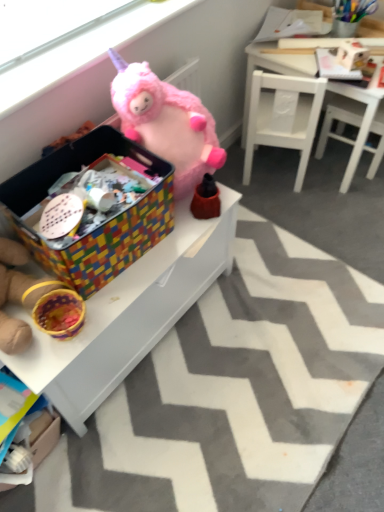
Where is `white matte chair at upper right`? The height and width of the screenshot is (512, 384). white matte chair at upper right is located at coordinates (283, 117).

What do you see at coordinates (128, 314) in the screenshot?
I see `white painted wood table at center, which appears as the first table when ordered from the bottom` at bounding box center [128, 314].

What do you see at coordinates (18, 295) in the screenshot?
I see `multicolored woven basket at left, which is the third toy in top-to-bottom order` at bounding box center [18, 295].

Measure the distance between point [149,246] and camera.

The distance of point [149,246] from camera is 3.88 feet.

Where is `pink plush unicorn at upper center`? The height and width of the screenshot is (512, 384). pink plush unicorn at upper center is located at coordinates (81, 53).

Is brown matte toy at center, which is the second toy in bottom-to-top order, oriented away from white painted wood table at center, which appears as the first table when ordered from the bottom?

brown matte toy at center, which is the second toy in bottom-to-top order, does not have its back to white painted wood table at center, which appears as the first table when ordered from the bottom.

There is a brown matte toy at center, which is the second toy in bottom-to-top order. At what (x,y) coordinates should I click in order to perform the action: click on the 2nd table below it (from a real-world perspective). Please return your answer as a coordinate pair (x, y). Looking at the image, I should click on (128, 314).

Could you measure the distance between brown matte toy at center, the 2th toy when ordered from top to bottom, and white painted wood table at center, the second table from the right?

They are 12.98 inches apart.

Is point (213, 208) positioned before point (134, 268)?

No, it is behind (134, 268).

Between fuzzy pink stuffed animal at upper center, which is counted as the 1th toy, starting from the top, and multicolored woven basket at left, which is the third toy in top-to-bottom order, which one has smaller width?

Thinner between the two is multicolored woven basket at left, which is the third toy in top-to-bottom order.

From a real-world perspective, who is located lower, fuzzy pink stuffed animal at upper center, the 3th toy positioned from the bottom, or multicolored woven basket at left, the 1th toy ordered from the bottom?

In real-world perspective, multicolored woven basket at left, the 1th toy ordered from the bottom, is lower.

Considering the relative sizes of fuzzy pink stuffed animal at upper center, the 3th toy positioned from the bottom, and multicolored woven basket at left, which is the third toy in top-to-bottom order, in the image provided, is fuzzy pink stuffed animal at upper center, the 3th toy positioned from the bottom, shorter than multicolored woven basket at left, which is the third toy in top-to-bottom order,?

In fact, fuzzy pink stuffed animal at upper center, the 3th toy positioned from the bottom, may be taller than multicolored woven basket at left, which is the third toy in top-to-bottom order.

Considering the relative sizes of fuzzy pink stuffed animal at upper center, the 3th toy positioned from the bottom, and multicolored woven basket at left, the 1th toy ordered from the bottom, in the image provided, is fuzzy pink stuffed animal at upper center, the 3th toy positioned from the bottom, bigger than multicolored woven basket at left, the 1th toy ordered from the bottom,?

Yes.

Considering the points (204, 184) and (72, 153), which point is in front, point (204, 184) or point (72, 153)?

The point (72, 153) is closer to the camera.

Is brown matte toy at center, the 2th toy when ordered from top to bottom, facing away from multicolored woven storage box at center?

No, brown matte toy at center, the 2th toy when ordered from top to bottom, is not facing the opposite direction of multicolored woven storage box at center.

Is brown matte toy at center, which is the second toy in bottom-to-top order, far away from multicolored woven storage box at center?

No, brown matte toy at center, which is the second toy in bottom-to-top order, is in close proximity to multicolored woven storage box at center.

Is brown matte toy at center, the 2th toy when ordered from top to bottom, positioned before multicolored woven storage box at center?

No, brown matte toy at center, the 2th toy when ordered from top to bottom, is further to the viewer.

Does fuzzy pink stuffed animal at upper center, the 3th toy positioned from the bottom, turn towards brown matte toy at center, which is the second toy in bottom-to-top order?

Yes.

Is fuzzy pink stuffed animal at upper center, the 3th toy positioned from the bottom, bigger than brown matte toy at center, the 2th toy when ordered from top to bottom?

Indeed, fuzzy pink stuffed animal at upper center, the 3th toy positioned from the bottom, has a larger size compared to brown matte toy at center, the 2th toy when ordered from top to bottom.

Which object is closer to the camera taking this photo, fuzzy pink stuffed animal at upper center, which is counted as the 1th toy, starting from the top, or brown matte toy at center, which is the second toy in bottom-to-top order?

fuzzy pink stuffed animal at upper center, which is counted as the 1th toy, starting from the top, is closer to the camera.

Does fuzzy pink stuffed animal at upper center, which is counted as the 1th toy, starting from the top, have a lesser height compared to brown matte toy at center, the 2th toy when ordered from top to bottom?

In fact, fuzzy pink stuffed animal at upper center, which is counted as the 1th toy, starting from the top, may be taller than brown matte toy at center, the 2th toy when ordered from top to bottom.

Would you say cardboard box at lower left is outside brown matte toy at center, which is the second toy in bottom-to-top order?

cardboard box at lower left is positioned outside brown matte toy at center, which is the second toy in bottom-to-top order.

Considering the sizes of cardboard box at lower left and brown matte toy at center, the 2th toy when ordered from top to bottom, in the image, is cardboard box at lower left taller or shorter than brown matte toy at center, the 2th toy when ordered from top to bottom,?

Considering their sizes, cardboard box at lower left has less height than brown matte toy at center, the 2th toy when ordered from top to bottom.

In the scene shown: Is cardboard box at lower left wider or thinner than brown matte toy at center, which is the second toy in bottom-to-top order?

Clearly, cardboard box at lower left has more width compared to brown matte toy at center, which is the second toy in bottom-to-top order.

Considering the relative sizes of cardboard box at lower left and brown matte toy at center, the 2th toy when ordered from top to bottom, in the image provided, is cardboard box at lower left smaller than brown matte toy at center, the 2th toy when ordered from top to bottom,?

No.

Would you say pink plush unicorn at upper center is part of multicolored woven storage box at center's contents?

No, multicolored woven storage box at center does not contain pink plush unicorn at upper center.

Does multicolored woven storage box at center have a smaller size compared to pink plush unicorn at upper center?

Incorrect, multicolored woven storage box at center is not smaller in size than pink plush unicorn at upper center.

Is multicolored woven storage box at center wider than pink plush unicorn at upper center?

Indeed, multicolored woven storage box at center has a greater width compared to pink plush unicorn at upper center.

From a real-world perspective, is multicolored woven storage box at center positioned under pink plush unicorn at upper center based on gravity?

Yes.

Does pink plush unicorn at upper center have a lesser width compared to multicolored woven storage box at center?

Indeed, pink plush unicorn at upper center has a lesser width compared to multicolored woven storage box at center.

From the image's perspective, relative to multicolored woven storage box at center, is pink plush unicorn at upper center above or below?

From the image's perspective, pink plush unicorn at upper center appears above multicolored woven storage box at center.

Is pink plush unicorn at upper center closer to camera compared to multicolored woven storage box at center?

That is False.

There is a white painted wood table at center, the second table from the right. Identify the location of the 2nd toy above it (from the image's perspective). (206, 199).

What are the coordinates of `toy that is the 1st one when counting backward from the multicolored woven basket at left, the 1th toy ordered from the bottom` in the screenshot? It's located at (166, 122).

Based on their spatial positions, is brown matte toy at center, which is the second toy in bottom-to-top order, or fuzzy pink stuffed animal at upper center, the 3th toy positioned from the bottom, further from cardboard box at lower left?

fuzzy pink stuffed animal at upper center, the 3th toy positioned from the bottom.

Considering their positions, is white matte chair at upper right positioned closer to pink plush unicorn at upper center than white wooden table at upper right, the first table in the top-to-bottom sequence?

white matte chair at upper right is positioned closer to the anchor pink plush unicorn at upper center.

Consider the image. When comparing their distances from multicolored woven basket at left, the 1th toy ordered from the bottom, does white wooden table at upper right, marked as the 1th table in a right-to-left arrangement, or multicolored woven storage box at center seem closer?

Among the two, multicolored woven storage box at center is located nearer to multicolored woven basket at left, the 1th toy ordered from the bottom.

Which object lies further to the anchor point multicolored woven storage box at center, fuzzy pink stuffed animal at upper center, which is counted as the 1th toy, starting from the top, or multicolored woven basket at left, which is the third toy in top-to-bottom order?

multicolored woven basket at left, which is the third toy in top-to-bottom order.

Estimate the real-world distances between objects in this image. Which object is further from pink plush unicorn at upper center, white matte chair at upper right or cardboard box at lower left?

cardboard box at lower left is further to pink plush unicorn at upper center.

Based on their spatial positions, is white painted wood table at center, which is the second table in top-to-bottom order, or multicolored woven basket at left, the 1th toy ordered from the bottom, further from cardboard box at lower left?

white painted wood table at center, which is the second table in top-to-bottom order, is further to cardboard box at lower left.

Which object lies nearer to the anchor point pink plush unicorn at upper center, white matte chair at upper right or multicolored woven basket at left, the 1th toy ordered from the bottom?

The object closer to pink plush unicorn at upper center is multicolored woven basket at left, the 1th toy ordered from the bottom.

From the image, which object appears to be farther from cardboard box at lower left, white wooden table at upper right, marked as the second table in a left-to-right arrangement, or white matte chair at upper right?

Based on the image, white wooden table at upper right, marked as the second table in a left-to-right arrangement, appears to be further to cardboard box at lower left.

Identify the location of table between brown matte toy at center, which is the second toy in bottom-to-top order, and cardboard box at lower left, in the vertical direction. (128, 314).

The height and width of the screenshot is (512, 384). In order to click on chair between white wooden table at upper right, the 2th table ordered from the bottom, and cardboard box at lower left vertically in this screenshot , I will do `click(283, 117)`.

The image size is (384, 512). Find the location of `chair between white wooden table at upper right, marked as the second table in a left-to-right arrangement, and white painted wood table at center, the first table positioned from the left, in the up-down direction`. chair between white wooden table at upper right, marked as the second table in a left-to-right arrangement, and white painted wood table at center, the first table positioned from the left, in the up-down direction is located at coordinates (283, 117).

Where is `table situated between pink plush unicorn at upper center and white wooden table at upper right, the 2th table ordered from the bottom, from left to right`? table situated between pink plush unicorn at upper center and white wooden table at upper right, the 2th table ordered from the bottom, from left to right is located at coordinates (128, 314).